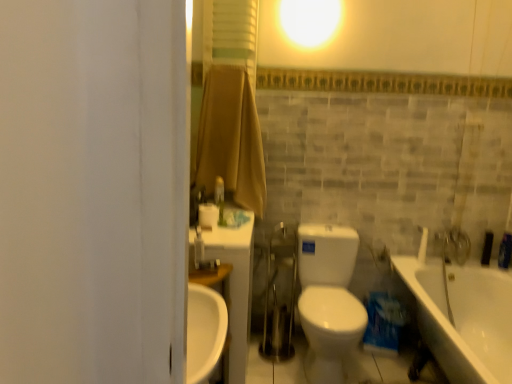
Image resolution: width=512 pixels, height=384 pixels. Identify the location of free spot to the left of white glossy faucet at upper right. (406, 263).